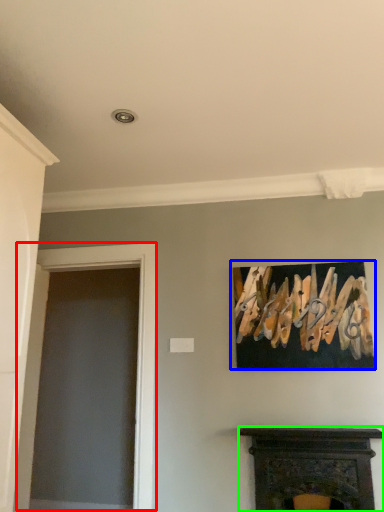
Question: Estimate the real-world distances between objects in this image. Which object is closer to glass door (highlighted by a red box), picture frame (highlighted by a blue box) or fireplace (highlighted by a green box)?

Choices:
 (A) picture frame
 (B) fireplace

Answer: (A)